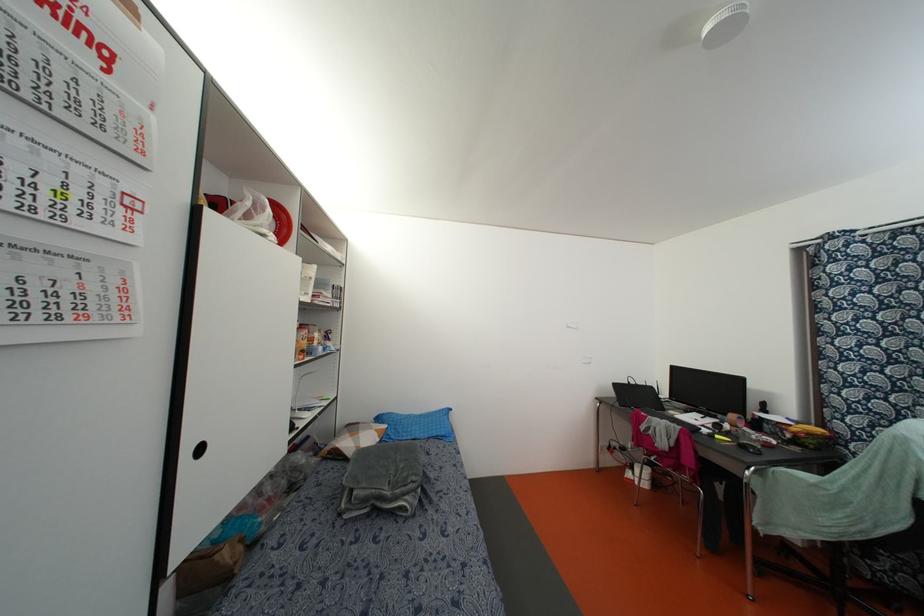
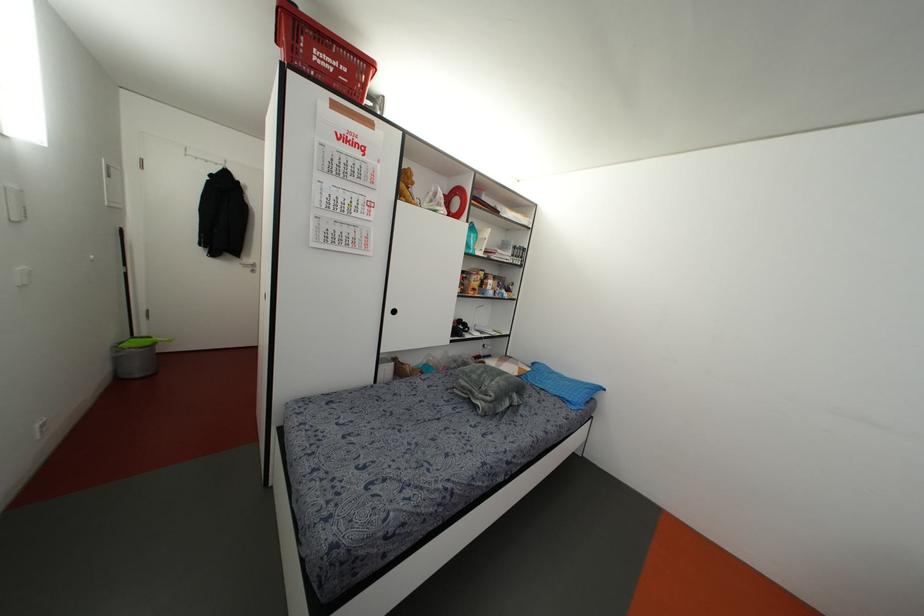
In the second image, find the point that corresponds to pixel 442 434 in the first image.

(569, 399)